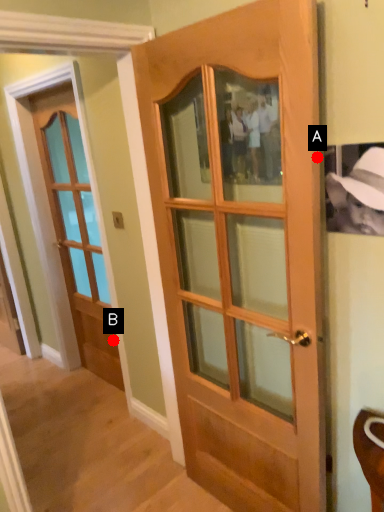
Question: Two points are circled on the image, labeled by A and B beside each circle. Which of the following is the farthest from the observer?

Choices:
 (A) A is further
 (B) B is further

Answer: (B)